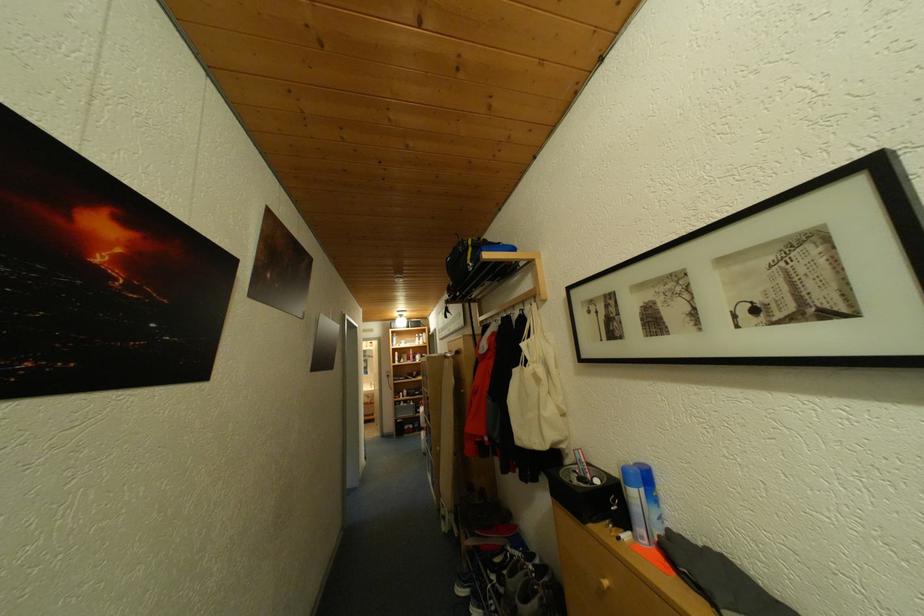
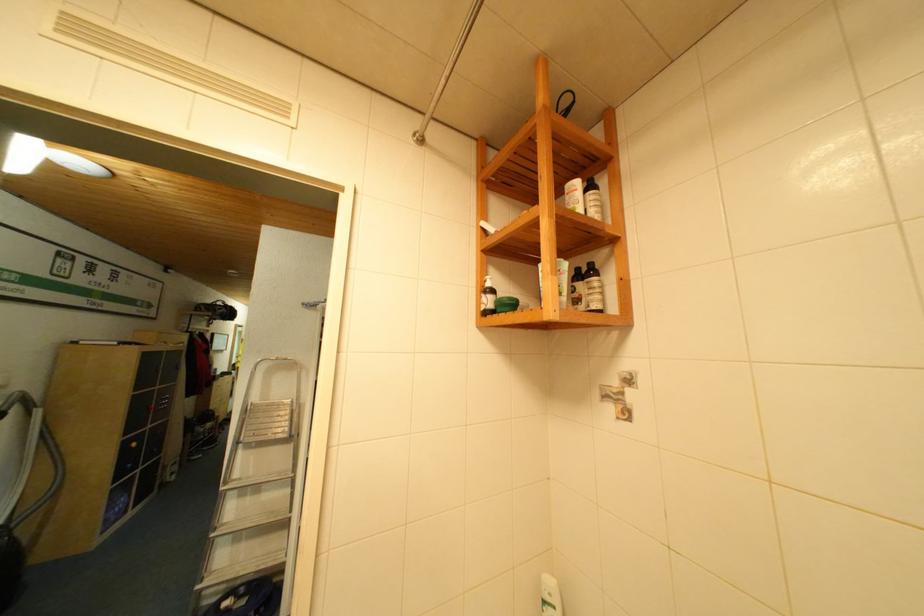
Question: I am providing you with two images of the same scene from different viewpoints. Which of the following objects are not visible in image2?

Choices:
 (A) small cabinet knob
 (B) black backpack
 (C) bee-shaped magnet
 (D) white pump bottle

Answer: (B)